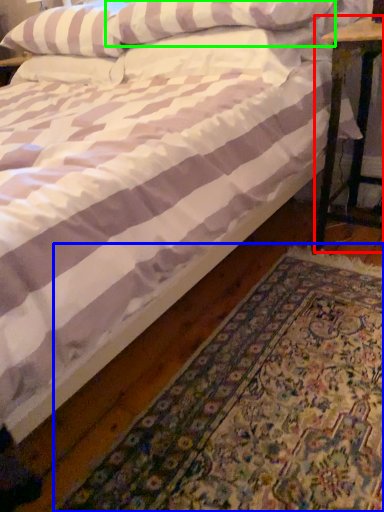
Question: Which is nearer to the table (highlighted by a red box)? mat (highlighted by a blue box) or pillow (highlighted by a green box).

Choices:
 (A) mat
 (B) pillow

Answer: (B)